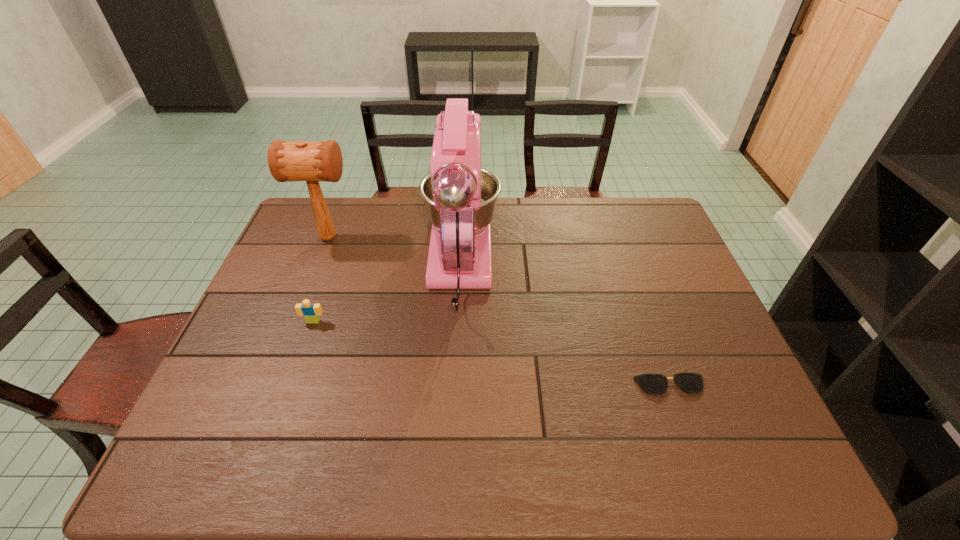
Locate an element on the screen. free space at the right edge is located at coordinates (725, 380).

The image size is (960, 540). What are the coordinates of `free space at the far right corner` in the screenshot? It's located at (x=643, y=211).

What are the coordinates of `vacant area between the nearest object and the mixer` in the screenshot? It's located at (565, 326).

Where is `free space between the second shortest object and the nearest object`? Image resolution: width=960 pixels, height=540 pixels. free space between the second shortest object and the nearest object is located at coordinates click(x=492, y=353).

Where is `vacant area between the mixer and the rightmost object`? Image resolution: width=960 pixels, height=540 pixels. vacant area between the mixer and the rightmost object is located at coordinates (565, 326).

Where is `vacant area that lies between the shortest object and the tallest object`? vacant area that lies between the shortest object and the tallest object is located at coordinates (565, 326).

This screenshot has height=540, width=960. Identify the location of vacant space in between the second shortest object and the tallest object. (387, 294).

Find the location of a particular element. This screenshot has height=540, width=960. empty location between the Lego and the tallest object is located at coordinates (387, 294).

Image resolution: width=960 pixels, height=540 pixels. Identify the location of unoccupied area between the mallet and the tallest object. (395, 252).

Locate an element on the screen. This screenshot has height=540, width=960. empty space between the third tallest object and the rightmost object is located at coordinates (492, 353).